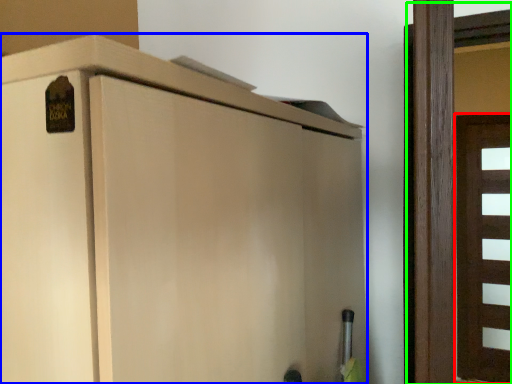
Question: Based on their relative distances, which object is farther from door (highlighted by a red box)? Choose from cupboard (highlighted by a blue box) and door (highlighted by a green box).

Choices:
 (A) cupboard
 (B) door

Answer: (A)